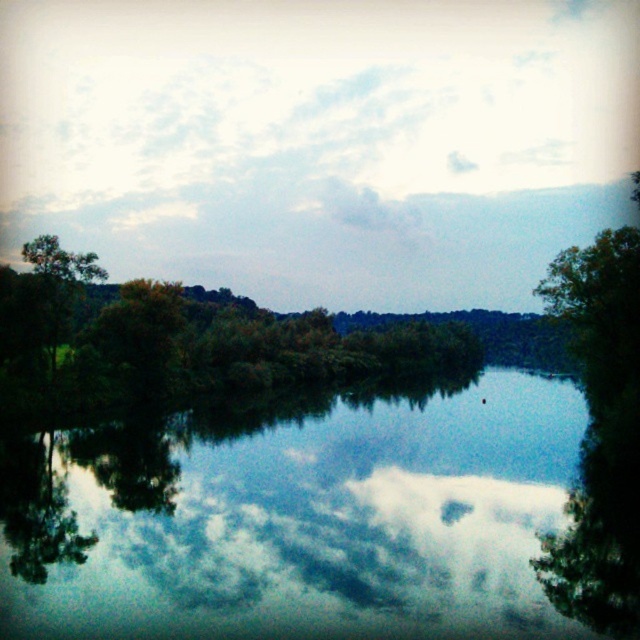
Question: Is transparent glass water at center bigger than green leafy trees at lower left?

Choices:
 (A) yes
 (B) no

Answer: (A)

Question: Which point appears closest to the camera in this image?

Choices:
 (A) (116, 504)
 (B) (97, 262)

Answer: (A)

Question: Which is nearer to the green leafy tree at left?

Choices:
 (A) green leafy tree at right
 (B) green leafy trees at lower left

Answer: (B)

Question: Does green leafy tree at right have a smaller size compared to green leafy trees at lower left?

Choices:
 (A) no
 (B) yes

Answer: (A)

Question: Can you confirm if green leafy tree at right is positioned above green leafy trees at lower left?

Choices:
 (A) no
 (B) yes

Answer: (B)

Question: Considering the real-world distances, which object is closest to the green leafy tree at left?

Choices:
 (A) green leafy tree at right
 (B) green leafy trees at lower left
 (C) transparent glass water at center

Answer: (B)